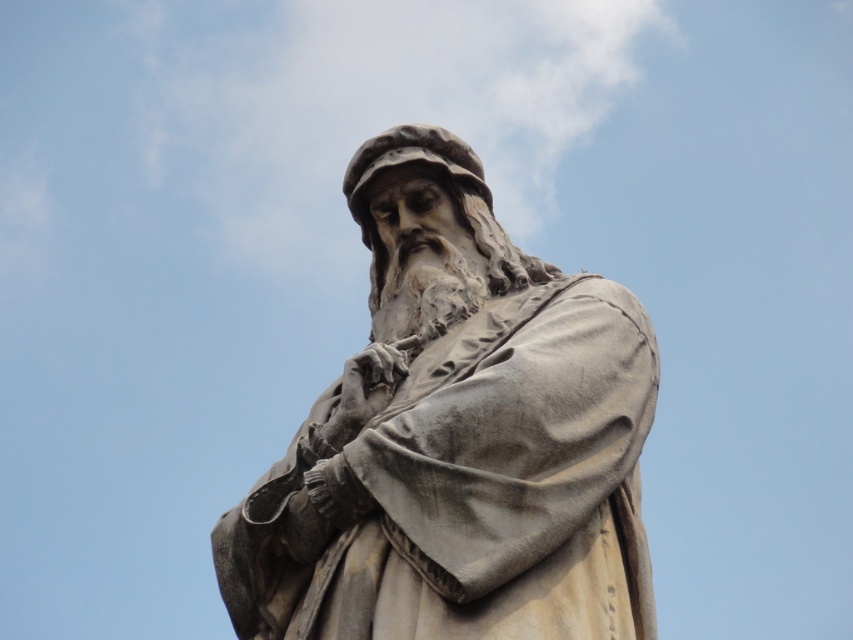
You are an art student observing the statue of Leonardo da Vinci. You notice the gray stone statue at center and the white fluffy cloud at upper center. Which object is positioned closer to you in the scene?

The gray stone statue at center is closer to the viewer than the white fluffy cloud at upper center.

You are standing in front of the statue of Leonardo da Vinci. There is a point marked at coordinates (456, 436). What does this point represent?

The point at coordinates (456, 436) corresponds to the gray stone statue at center.